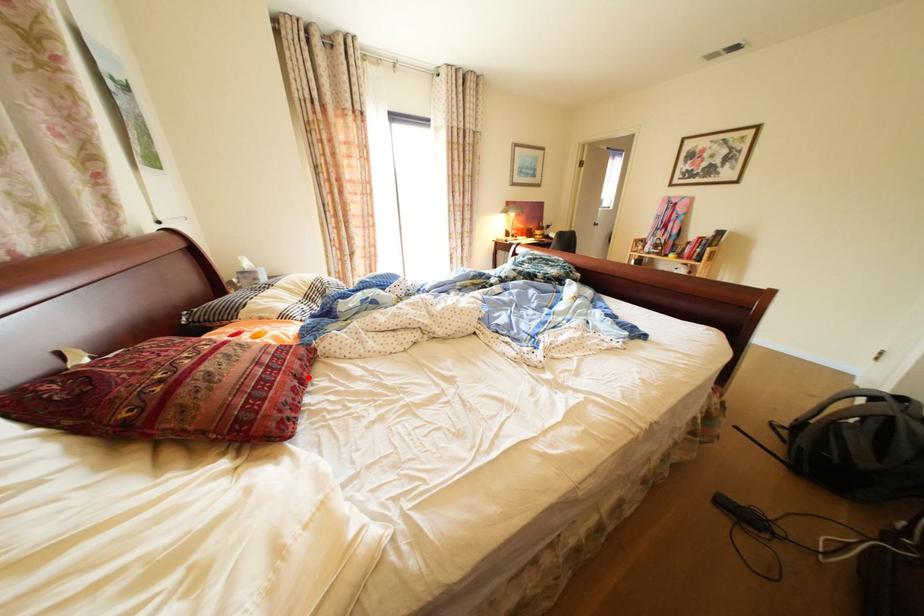
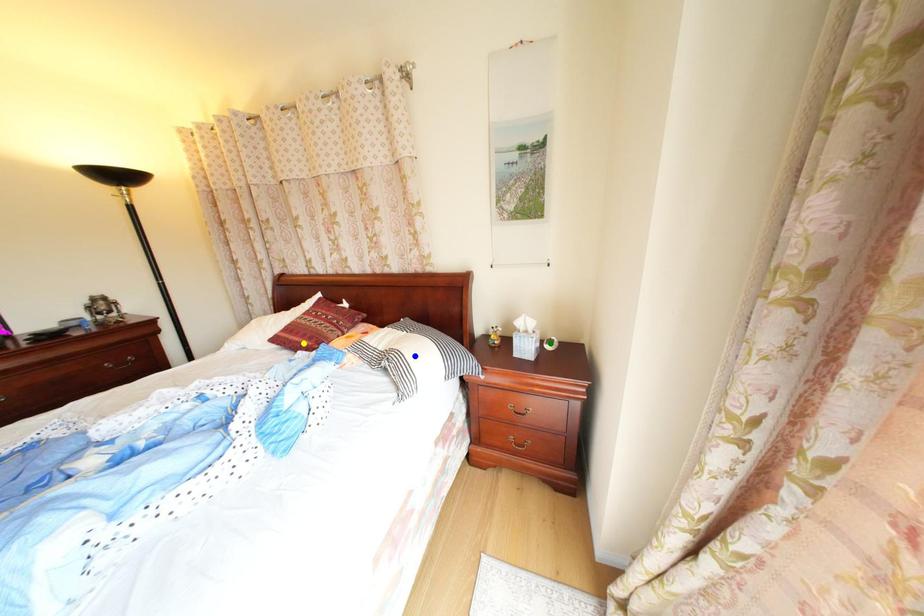
Question: I am providing you with two images of the same scene from different viewpoints. A red point is marked on the first image. You are given multiple points on the second image. Which point in image 2 is actually the same real-world point as the red point in image 1?

Choices:
 (A) yellow point
 (B) blue point
 (C) green point

Answer: (A)